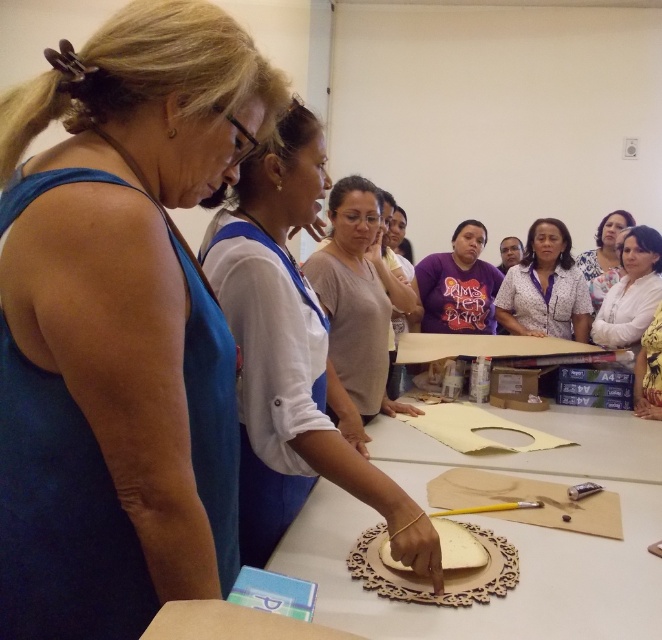
You are a participant in the workshop and need to pass a small tool to the person wearing the white dotted blouse at center without disturbing the person in the white textured blouse at upper center. What is the minimum distance you need to move the tool?

The minimum distance you need to move the tool is 15.03 inches to reach the white dotted blouse at center from the white textured blouse at upper center.